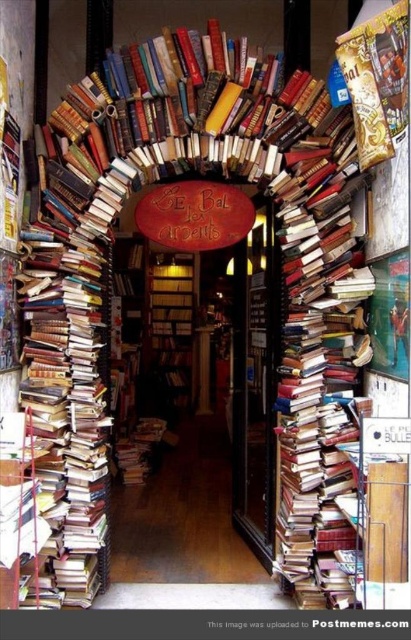
You are standing at the entrance of Le Bal des Arabes bookstore, which is framed by a tunnel of stacked books. You notice two points marked on the floor inside the store. The first point is at coordinates point (x=258, y=348) and the second is at point (x=157, y=372). If you are facing the interior of the store, which point is closer to you?

Point (x=258, y=348) is in front of point (x=157, y=372), so the point closer to you would be point (x=258, y=348).